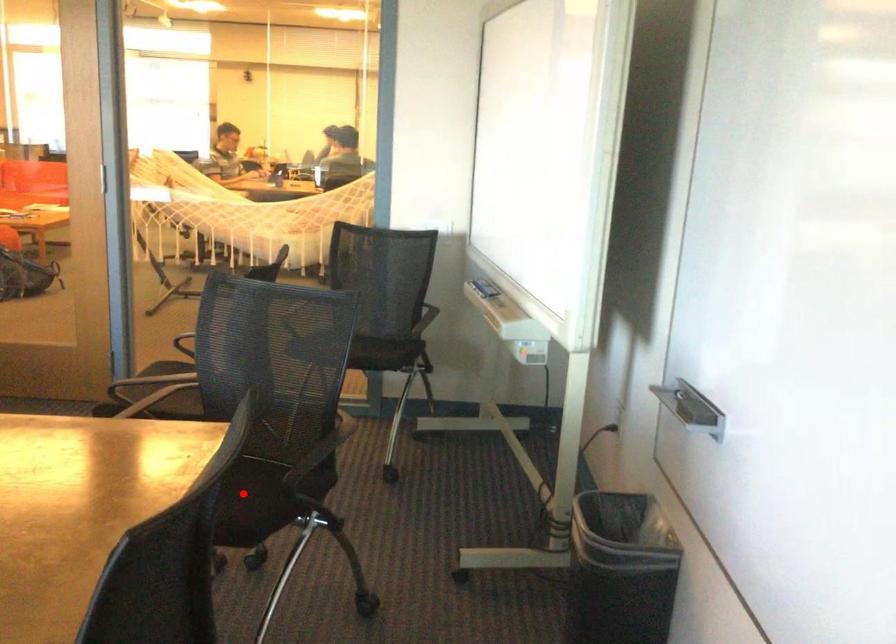
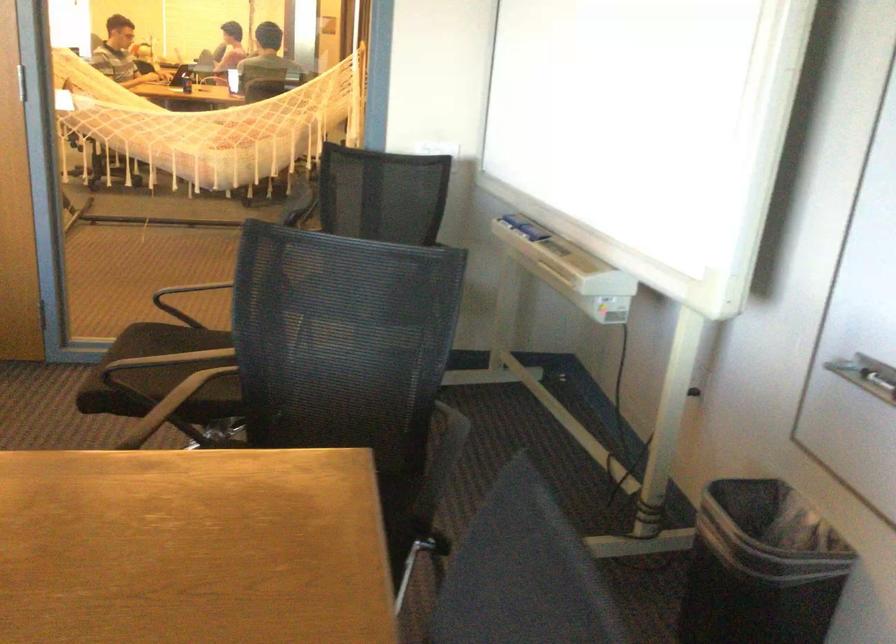
Question: I am providing you with two images of the same scene from different viewpoints. A red point is marked on the first image. At the location where the point appears in image 1, is it still visible in image 2?

Choices:
 (A) Yes
 (B) No

Answer: (B)